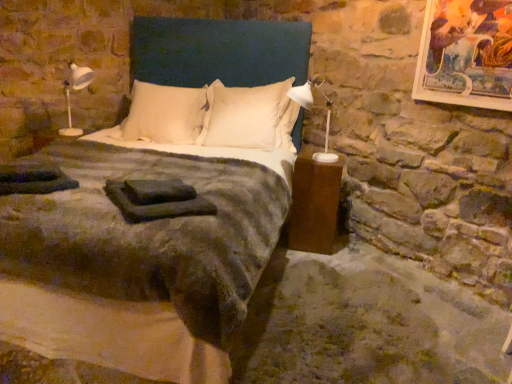
Question: Is dark green fabric at center in front of or behind metallic gold picture frame at upper right in the image?

Choices:
 (A) front
 (B) behind

Answer: (A)

Question: Considering the relative positions of dark green fabric at center and metallic gold picture frame at upper right in the image provided, is dark green fabric at center to the left or to the right of metallic gold picture frame at upper right?

Choices:
 (A) right
 (B) left

Answer: (B)

Question: Which is nearer to the dark green fabric at center?

Choices:
 (A) velvet dark green bed at center
 (B) white plastic lamp at right, the 1th bedside lamp when ordered from right to left
 (C) dark blue fabric headboard at center
 (D) white soft pillow at center, marked as the 1th pillow in a right-to-left arrangement
 (E) brown matte nightstand at right

Answer: (A)

Question: Estimate the real-world distances between objects in this image. Which object is farther from the dark green fabric at center?

Choices:
 (A) dark blue fabric headboard at center
 (B) velvet dark green bed at center
 (C) white soft pillow at center, which is the 2th pillow in left-to-right order
 (D) brown matte nightstand at right
 (E) white plastic lamp at left, placed as the 1th bedside lamp when sorted from left to right

Answer: (A)